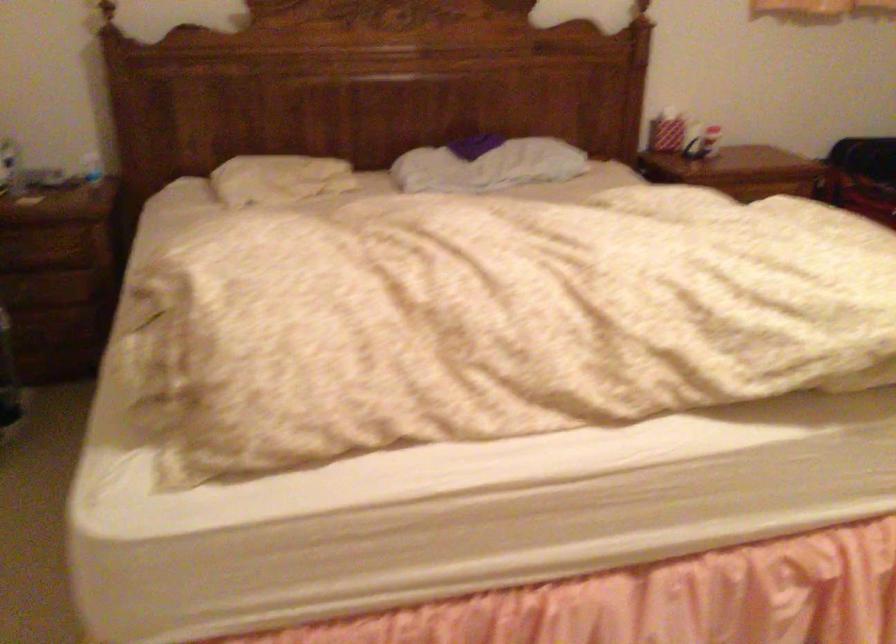
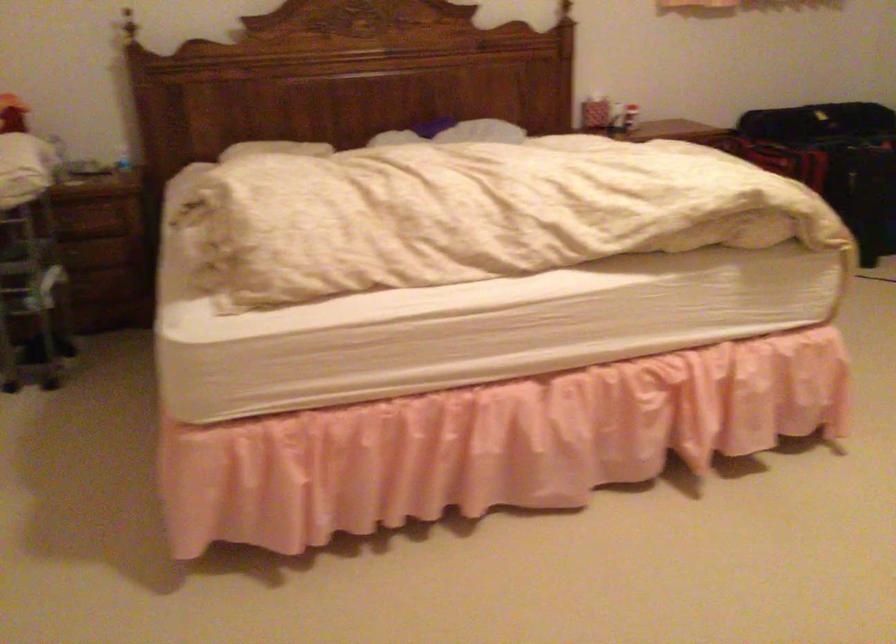
Question: The images are taken continuously from a first-person perspective. In which direction is your viewpoint rotating?

Choices:
 (A) Left
 (B) Right
 (C) Up
 (D) Down

Answer: (B)